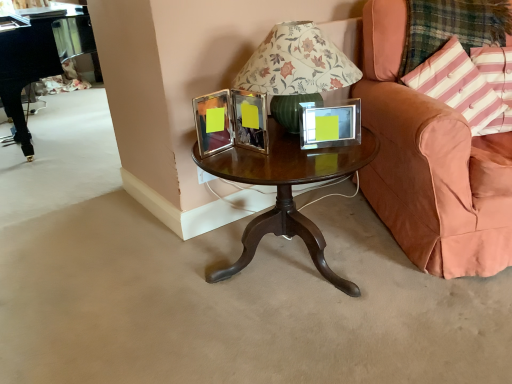
Where is `empty space that is ontop of mahogany wood coffee table at center (from a real-world perspective)`? empty space that is ontop of mahogany wood coffee table at center (from a real-world perspective) is located at coordinates (290, 152).